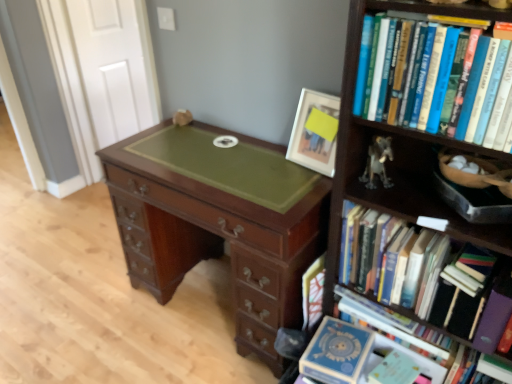
Find the location of a particular element. The image size is (512, 384). vacant space in front of matte white picture frame at upper right is located at coordinates (307, 180).